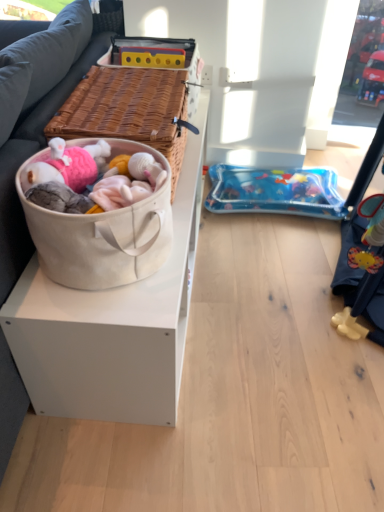
I want to click on free point in front of blue inflatable mattress at lower right, so click(271, 258).